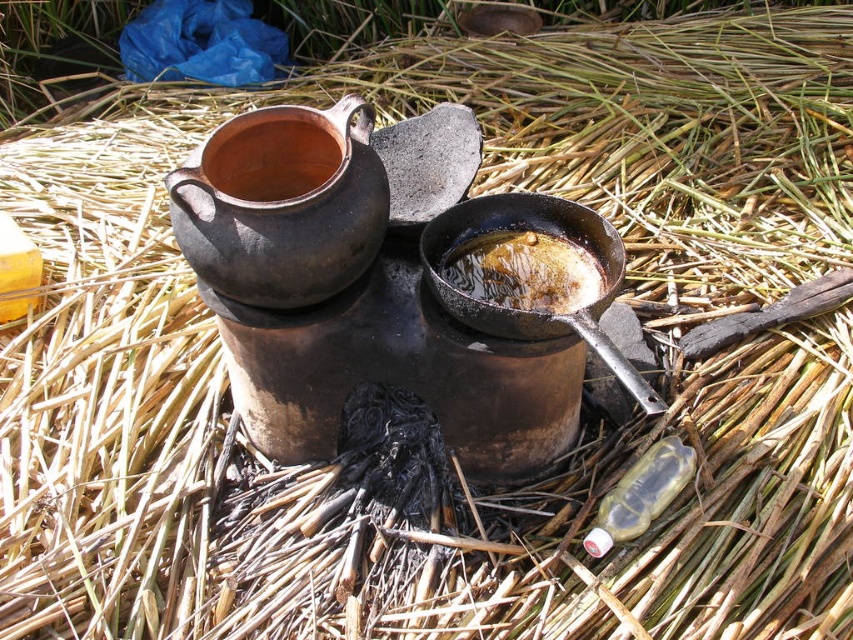
Question: Does matte clay teapot at upper left appear under brown matte oil at center?

Choices:
 (A) yes
 (B) no

Answer: (B)

Question: Based on their relative distances, which object is nearer to the matte clay pot at center?

Choices:
 (A) matte clay teapot at upper left
 (B) brown matte oil at center

Answer: (A)

Question: Estimate the real-world distances between objects in this image. Which object is farther from the brown matte oil at center?

Choices:
 (A) matte clay teapot at upper left
 (B) matte clay pot at center

Answer: (B)

Question: Considering the real-world distances, which object is closest to the matte clay teapot at upper left?

Choices:
 (A) matte clay pot at center
 (B) brown matte oil at center

Answer: (A)

Question: From the image, what is the correct spatial relationship of brown matte oil at center in relation to matte clay pot at center?

Choices:
 (A) below
 (B) above

Answer: (A)

Question: Is the position of matte clay teapot at upper left less distant than that of brown matte oil at center?

Choices:
 (A) no
 (B) yes

Answer: (B)